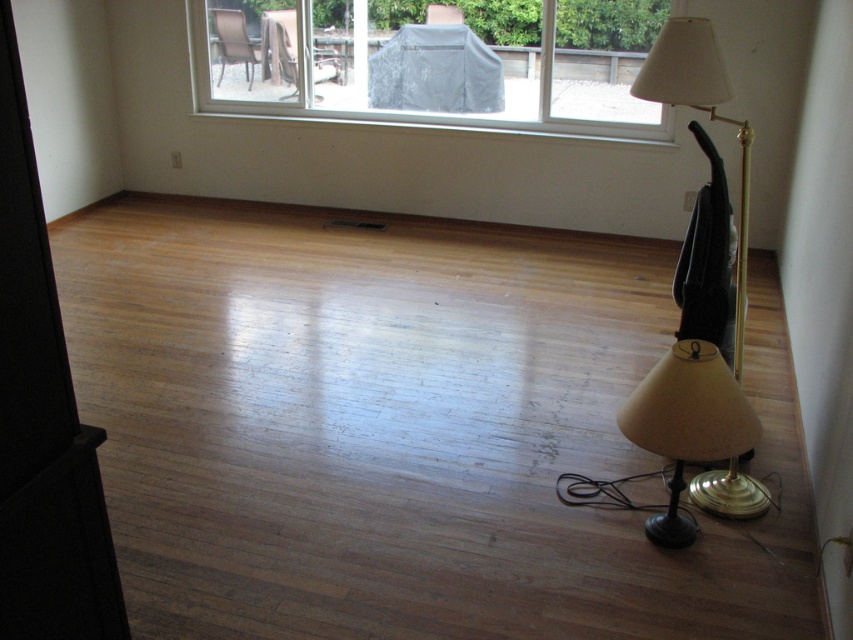
Question: Which object appears closest to the camera in this image?

Choices:
 (A) brown woven chair at upper left
 (B) matte gold lampshade at lower right
 (C) wooden textured chair at upper center
 (D) gold metallic floor lamp at right

Answer: (B)

Question: Which point appears closest to the camera in this image?

Choices:
 (A) (318, 97)
 (B) (722, 376)

Answer: (B)

Question: Which of the following is the closest to the observer?

Choices:
 (A) brown woven chair at upper left
 (B) matte gold lampshade at lower right
 (C) gold metallic floor lamp at right

Answer: (B)

Question: Considering the relative positions of wooden textured chair at upper center and brown woven chair at upper left in the image provided, where is wooden textured chair at upper center located with respect to brown woven chair at upper left?

Choices:
 (A) below
 (B) above

Answer: (A)

Question: Does clear glass window at upper center come in front of gold metallic floor lamp at right?

Choices:
 (A) no
 (B) yes

Answer: (A)

Question: Does matte gold lampshade at lower right have a smaller size compared to brown woven chair at upper left?

Choices:
 (A) yes
 (B) no

Answer: (B)